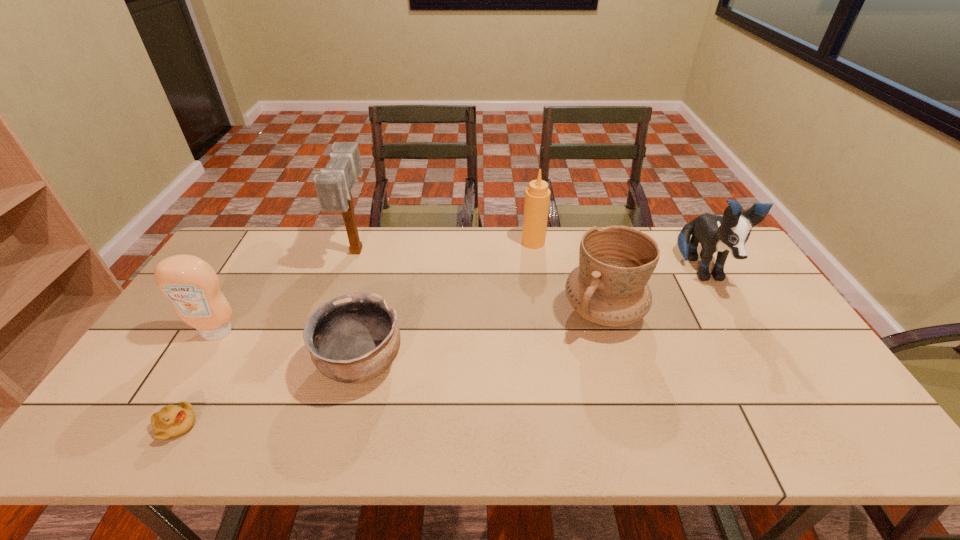
Identify the location of duckling. The image size is (960, 540). (171, 421).

I want to click on vacant space located on the right of the mallet, so click(444, 251).

Find the location of a particular element. free space located 0.200m on the front-facing side of the puppy is located at coordinates click(x=749, y=354).

Where is `vacant space located on the right of the fifth object from left to right`? The width and height of the screenshot is (960, 540). vacant space located on the right of the fifth object from left to right is located at coordinates (616, 242).

Identify the location of vacant position located 0.200m on the label of the left condiment. The width and height of the screenshot is (960, 540). (171, 408).

Image resolution: width=960 pixels, height=540 pixels. Identify the location of vacant region located on the back of the right pottery. (578, 227).

Locate an element on the screen. vacant space located 0.080m on the right of the sixth tallest object is located at coordinates (435, 363).

You are a GUI agent. You are given a task and a screenshot of the screen. Output one action in this format:
    pyautogui.click(x=<x>, y=<y>)
    Task: Click on the free space located on the front-facing side of the duckling
    
    Given the screenshot: What is the action you would take?
    pyautogui.click(x=353, y=426)

This screenshot has height=540, width=960. Find the location of `mallet located in the far edge section of the desktop`. mallet located in the far edge section of the desktop is located at coordinates (333, 186).

Find the location of a particular element. The height and width of the screenshot is (540, 960). puppy situated at the far edge is located at coordinates (729, 233).